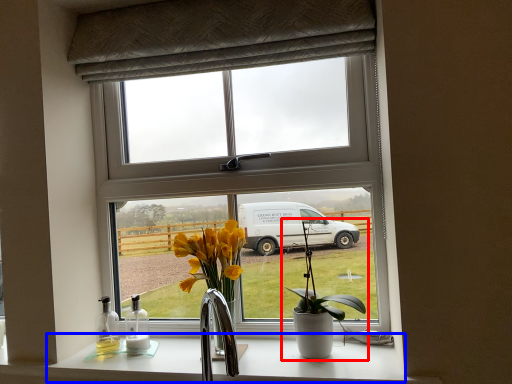
Question: Which object appears closest to the camera in this image, houseplant (highlighted by a red box) or counter top (highlighted by a blue box)?

Choices:
 (A) houseplant
 (B) counter top

Answer: (B)